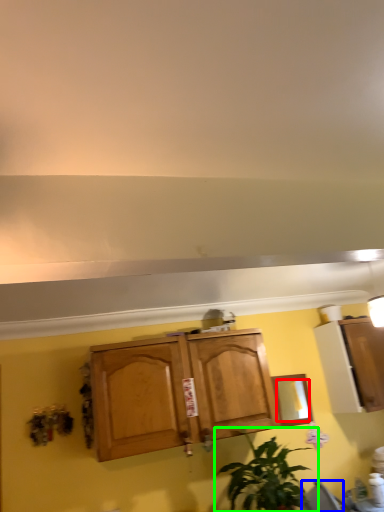
Question: Considering the real-world distances, which object is closest to mirror (highlighted by a red box)? chair (highlighted by a blue box) or houseplant (highlighted by a green box).

Choices:
 (A) chair
 (B) houseplant

Answer: (B)